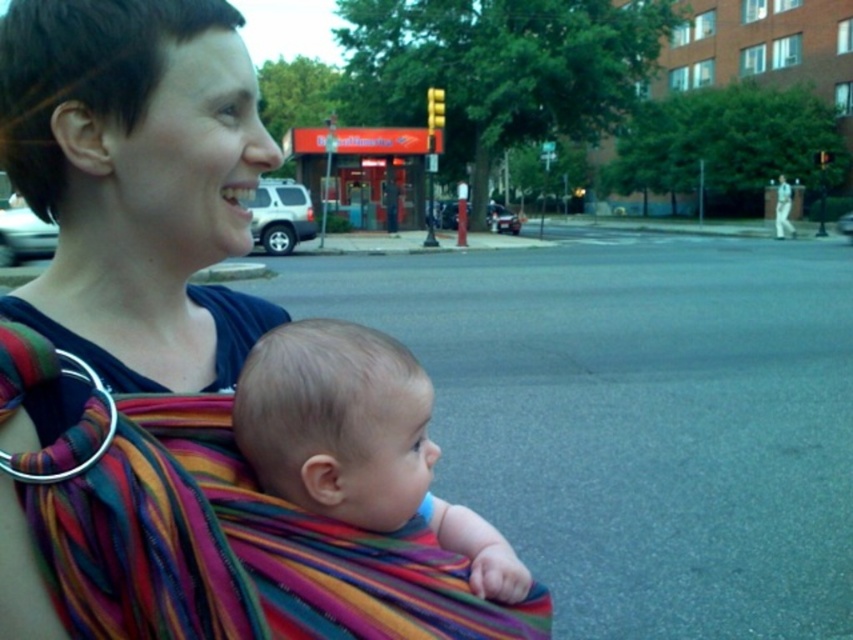
Between multicolored woven carrier at center and soft beige baby at center, which one is positioned lower?

soft beige baby at center

Which of these two, multicolored woven carrier at center or soft beige baby at center, stands shorter?

soft beige baby at center

Does point (57, 22) come in front of point (396, 440)?

No.

Find the location of a particular element. The image size is (853, 640). multicolored woven carrier at center is located at coordinates (166, 358).